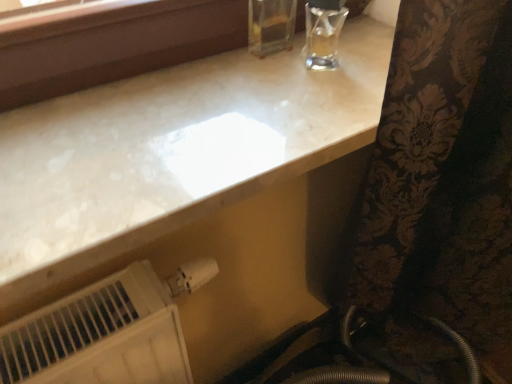
Question: Does point (315, 79) appear closer or farther from the camera than point (142, 319)?

Choices:
 (A) farther
 (B) closer

Answer: (A)

Question: From the image's perspective, is white marble countertop at upper center located above or below white plastic radiator at lower left?

Choices:
 (A) above
 (B) below

Answer: (A)

Question: In the image, is white marble countertop at upper center on the left side or the right side of white plastic radiator at lower left?

Choices:
 (A) left
 (B) right

Answer: (B)

Question: Is white plastic radiator at lower left to the left or to the right of white marble countertop at upper center in the image?

Choices:
 (A) left
 (B) right

Answer: (A)

Question: Considering the positions of point (104, 334) and point (392, 31), is point (104, 334) closer or farther from the camera than point (392, 31)?

Choices:
 (A) closer
 (B) farther

Answer: (A)

Question: Choose the correct answer: Is white plastic radiator at lower left inside white marble countertop at upper center or outside it?

Choices:
 (A) outside
 (B) inside

Answer: (A)

Question: From the image's perspective, is white plastic radiator at lower left above or below white marble countertop at upper center?

Choices:
 (A) above
 (B) below

Answer: (B)